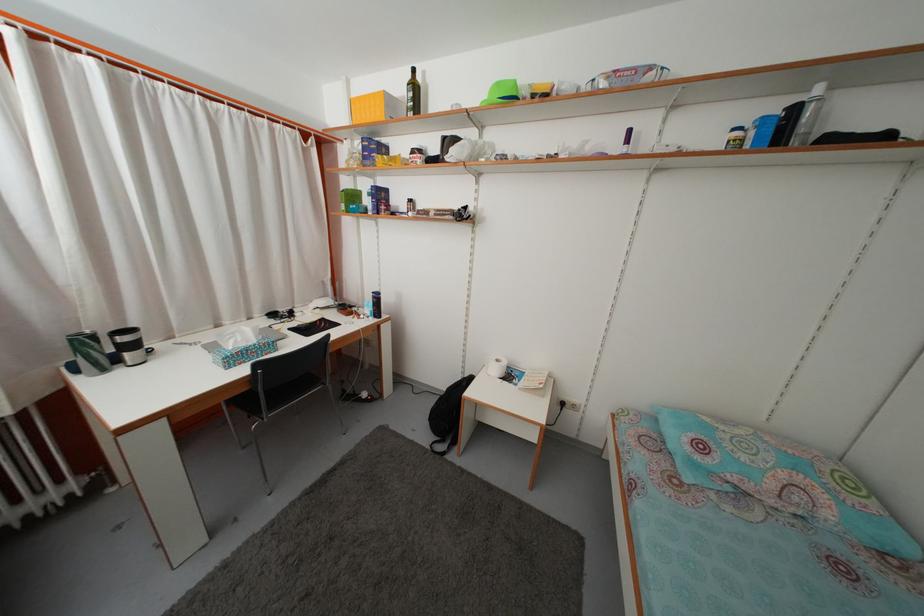
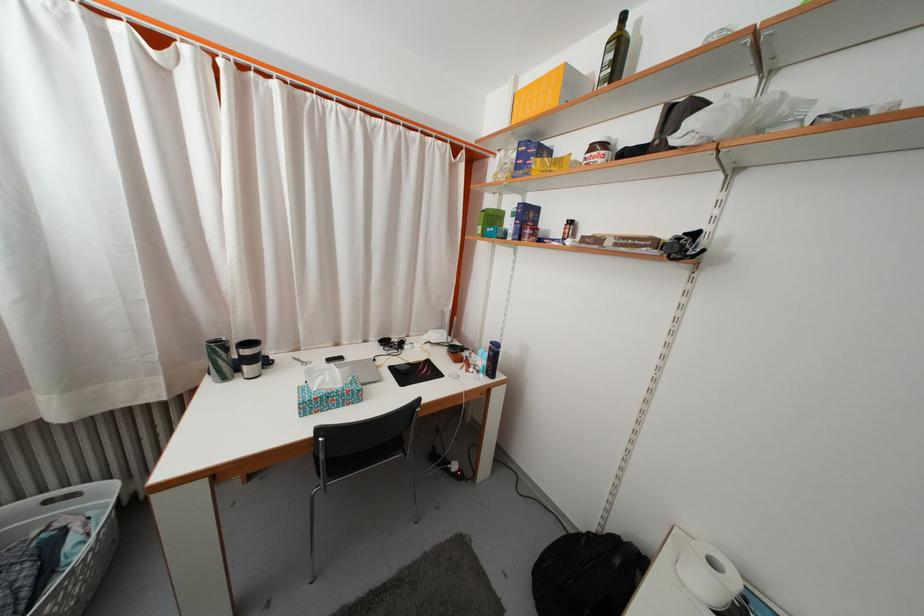
The point at (504, 368) is marked in the first image. Where is the corresponding point in the second image?

(718, 570)